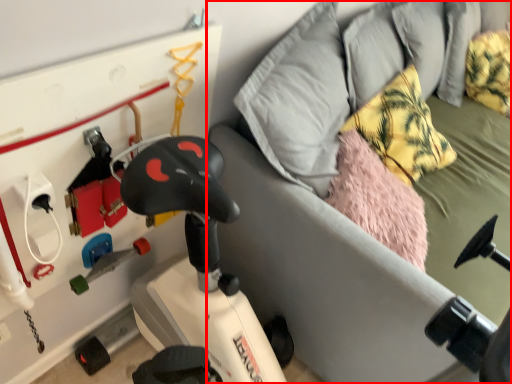
Question: From the image's perspective, considering the relative positions of furniture (annotated by the red box) and pillow in the image provided, where is furniture (annotated by the red box) located with respect to the staircase?

Choices:
 (A) below
 (B) above

Answer: (A)